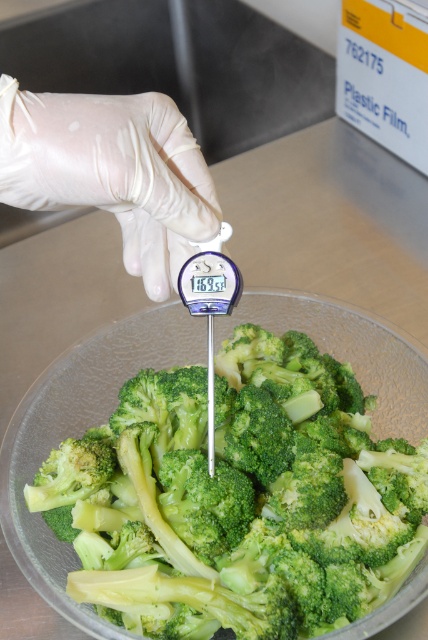
Question: Does green matte broccoli at center appear over white latex glove at upper left?

Choices:
 (A) yes
 (B) no

Answer: (B)

Question: Can you confirm if green matte broccoli at center is thinner than white latex glove at upper left?

Choices:
 (A) no
 (B) yes

Answer: (A)

Question: Is the position of green matte broccoli at center more distant than that of white latex glove at upper left?

Choices:
 (A) no
 (B) yes

Answer: (B)

Question: Which object is closer to the camera taking this photo?

Choices:
 (A) green matte broccoli at center
 (B) white latex glove at upper left

Answer: (B)

Question: Which object appears farthest from the camera in this image?

Choices:
 (A) white latex glove at upper left
 (B) green matte broccoli at center

Answer: (B)